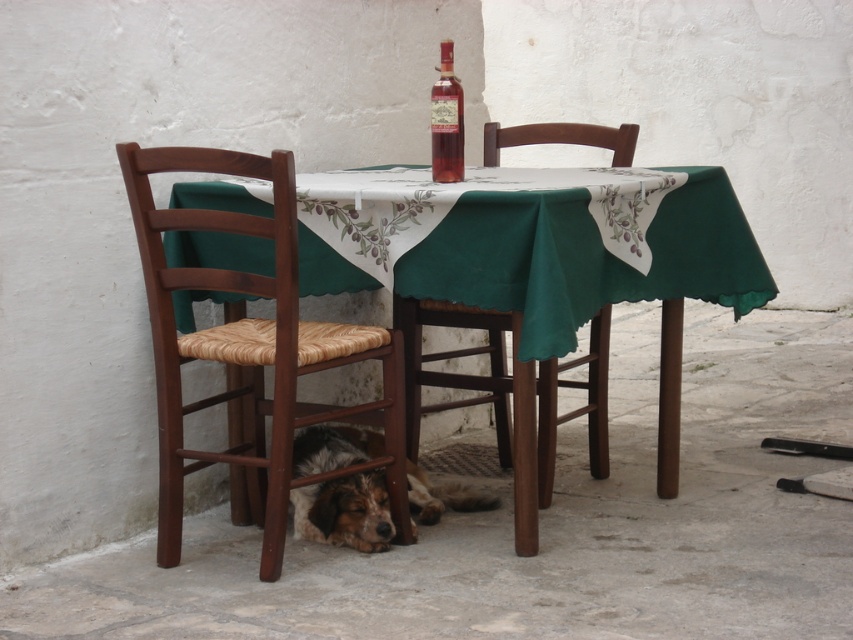
You are a guest at a garden party and need to choose a chair to sit on. The brown woven wood chair at lower left and the wooden woven seat chair at center are both available. Which chair is taller?

The brown woven wood chair at lower left is taller than the wooden woven seat chair at center.

You are planning to place a rectangular mat that is 1.2 meters wide between the brown woven wood chair at lower left and the wooden woven seat chair at center. Based on the scene description, will the mat fit comfortably between them without overlapping either chair?

The brown woven wood chair at lower left is narrower than the wooden woven seat chair at center. However, since the exact distance between them isn